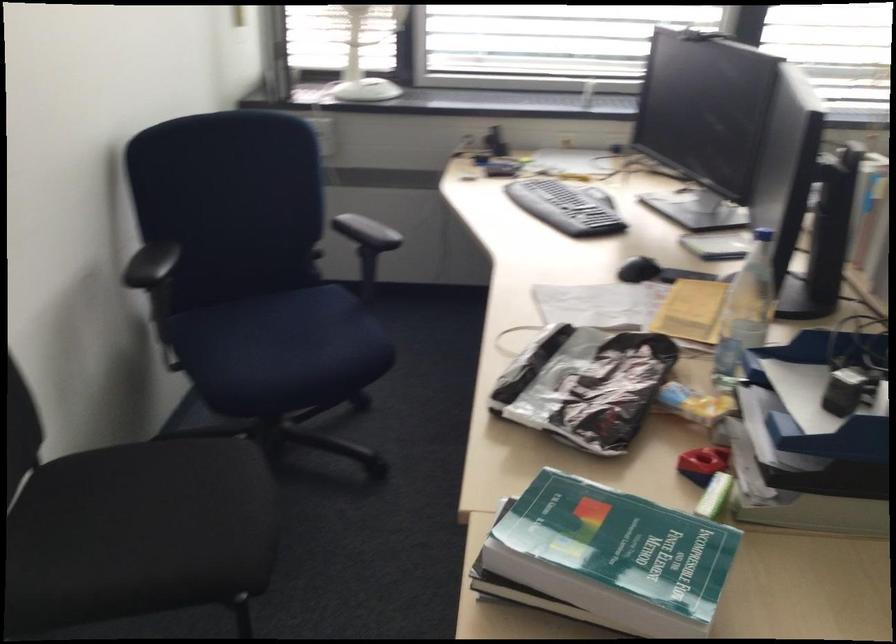
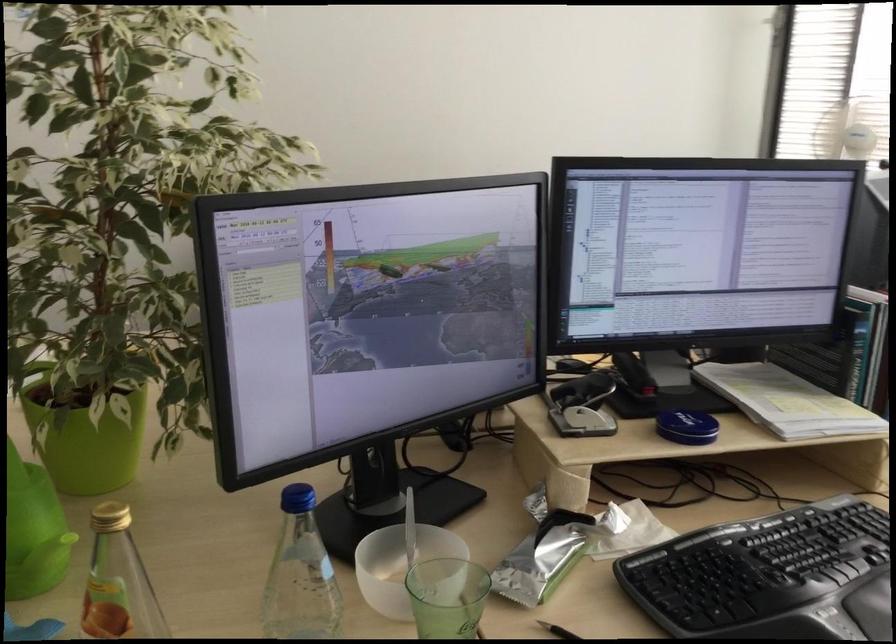
Question: I am providing you with two images of the same scene from different viewpoints. Which of the following objects are not visible in image2?

Choices:
 (A) white bowl
 (B) blue chair sitting surface
 (C) blue bottle cap
 (D) blue magazine

Answer: (B)